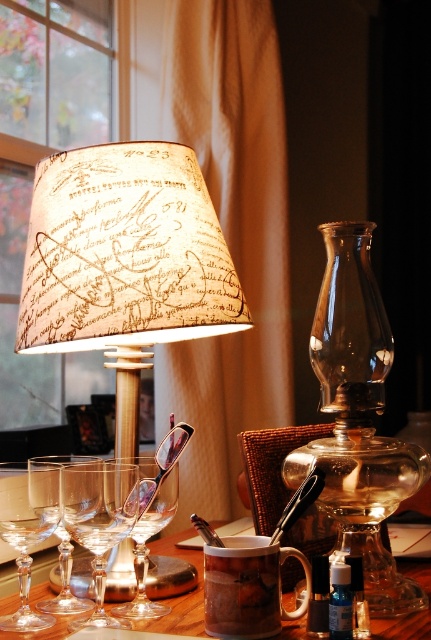
Question: Considering the real-world distances, which object is farthest from the clear crystal wine glass at lower left?

Choices:
 (A) shiny metal spoon at upper center
 (B) silver polished spoon at center

Answer: (A)

Question: Which point is closer to the camera?

Choices:
 (A) brown matte mug at center
 (B) clear glass wine glass at center

Answer: (A)

Question: Among these points, which one is farthest from the camera?

Choices:
 (A) (146, 323)
 (B) (164, 592)

Answer: (B)

Question: Does beige paper lampshade at upper left have a greater width compared to transparent glass wine glass at center?

Choices:
 (A) no
 (B) yes

Answer: (B)

Question: Can you confirm if brown matte mug at center is wider than silver polished spoon at center?

Choices:
 (A) yes
 (B) no

Answer: (A)

Question: Does beige paper lampshade at upper left appear on the right side of clear crystal wine glass at lower left?

Choices:
 (A) yes
 (B) no

Answer: (A)